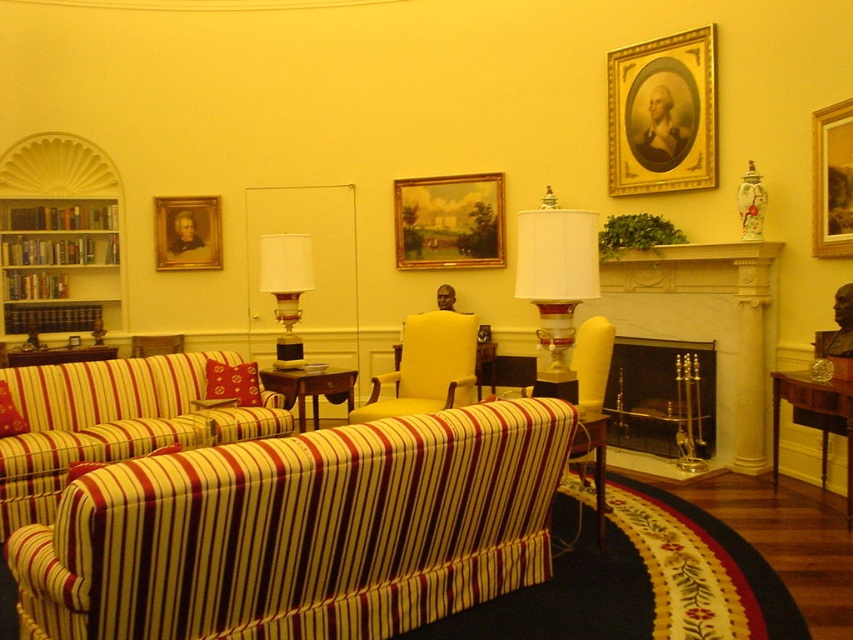
Is gold-framed painting at center taller than matte yellow armchair at center?

Yes, gold-framed painting at center is taller than matte yellow armchair at center.

Between gold-framed painting at center and matte yellow armchair at center, which one has more height?

gold-framed painting at center

Image resolution: width=853 pixels, height=640 pixels. Identify the location of gold-framed painting at center. (450, 221).

Who is more distant from viewer, (537, 256) or (265, 262)?

Point (265, 262)

Can you confirm if white fabric lampshade at center is positioned to the right of matte glass lamp at center?

Indeed, white fabric lampshade at center is positioned on the right side of matte glass lamp at center.

Describe the element at coordinates (556, 275) in the screenshot. This screenshot has height=640, width=853. I see `white fabric lampshade at center` at that location.

I want to click on white fabric lampshade at center, so click(x=556, y=275).

In the scene shown: Is wooden bookshelf at left bigger than goldmetallicpicture frame at upper center?

Correct, wooden bookshelf at left is larger in size than goldmetallicpicture frame at upper center.

Does point (48, 145) come behind point (656, 113)?

Yes, point (48, 145) is farther from viewer.

Between point (41, 284) and point (706, 141), which one is positioned in front?

Point (706, 141) is more forward.

Identify the location of wooden bookshelf at left. The width and height of the screenshot is (853, 640). (59, 236).